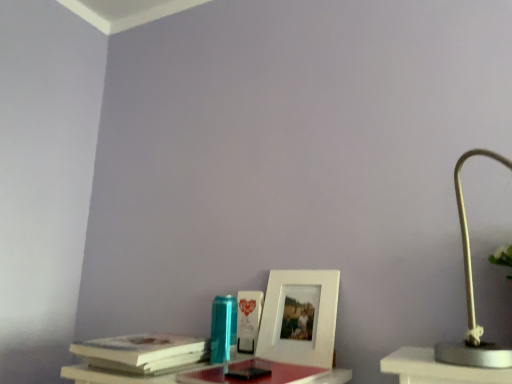
Question: From the image's perspective, is white paper at left above or below white matte picture frame at center?

Choices:
 (A) below
 (B) above

Answer: (A)

Question: Is white paper at left in front of or behind white matte picture frame at center in the image?

Choices:
 (A) front
 (B) behind

Answer: (A)

Question: Estimate the real-world distances between objects in this image. Which object is farther from the white matte lamp at right?

Choices:
 (A) white paper at left
 (B) smooth plastic table at lower center
 (C) white matte picture frame at center

Answer: (A)

Question: Which object is positioned closest to the smooth plastic table at lower center?

Choices:
 (A) white matte picture frame at center
 (B) white paper at left
 (C) white matte lamp at right

Answer: (B)